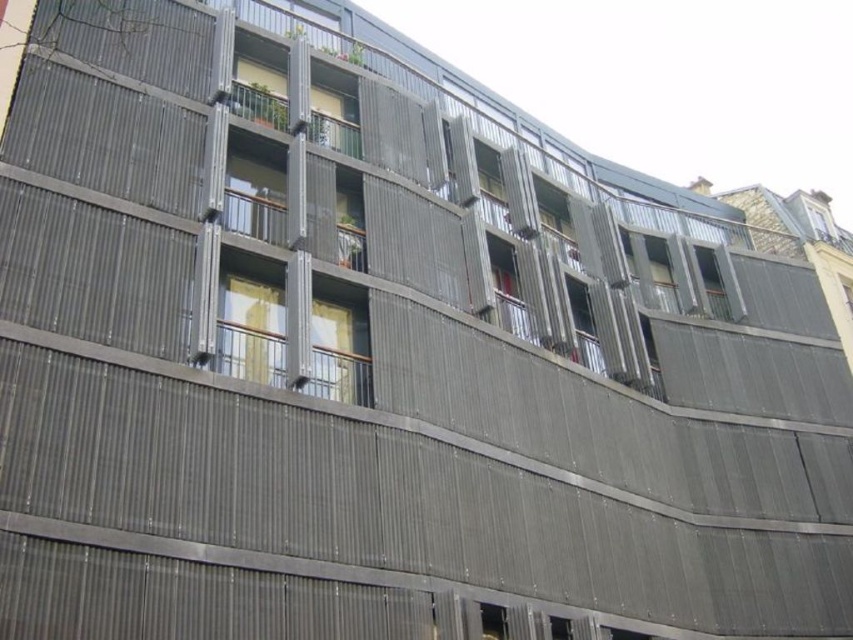
You are standing in front of the building and want to know which window is nearer to you between the matte gray window at upper center and the clear glass window at upper right. Can you determine this based on their positions?

The matte gray window at upper center is closer to the viewer than the clear glass window at upper right.

You are an architect reviewing the building design. You notice the matte gray window at upper center and the clear glass window at upper right. Which window should you recommend replacing if you need to install a larger window unit that requires more space?

The clear glass window at upper right should be replaced because it is larger than the matte gray window at upper center, providing more space for the larger window unit.